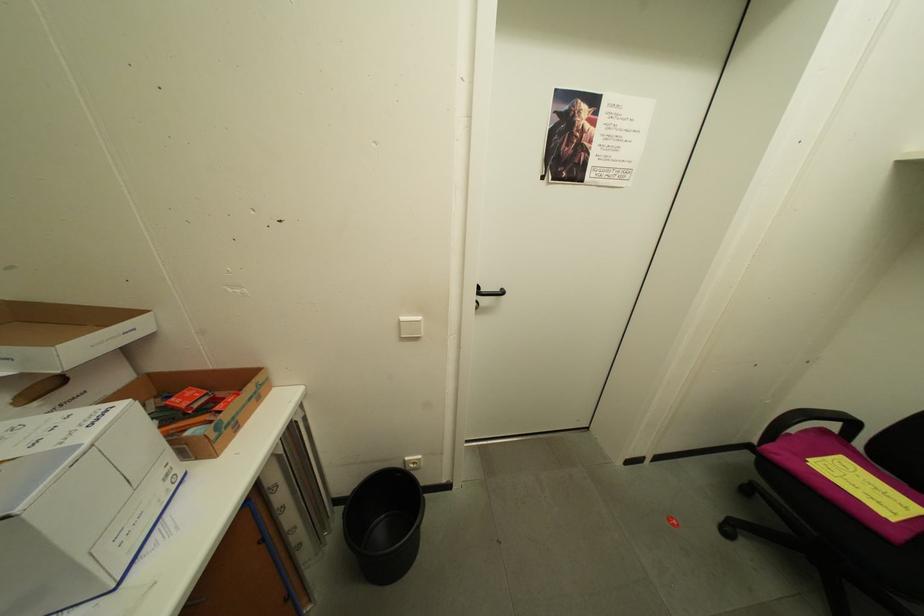
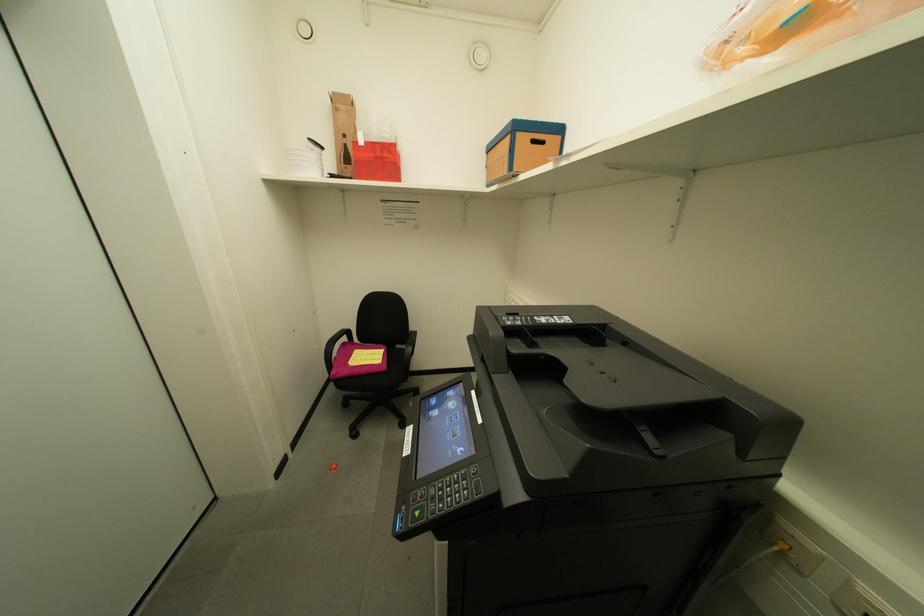
How did the camera likely rotate?

The rotation direction of the camera is right-down.